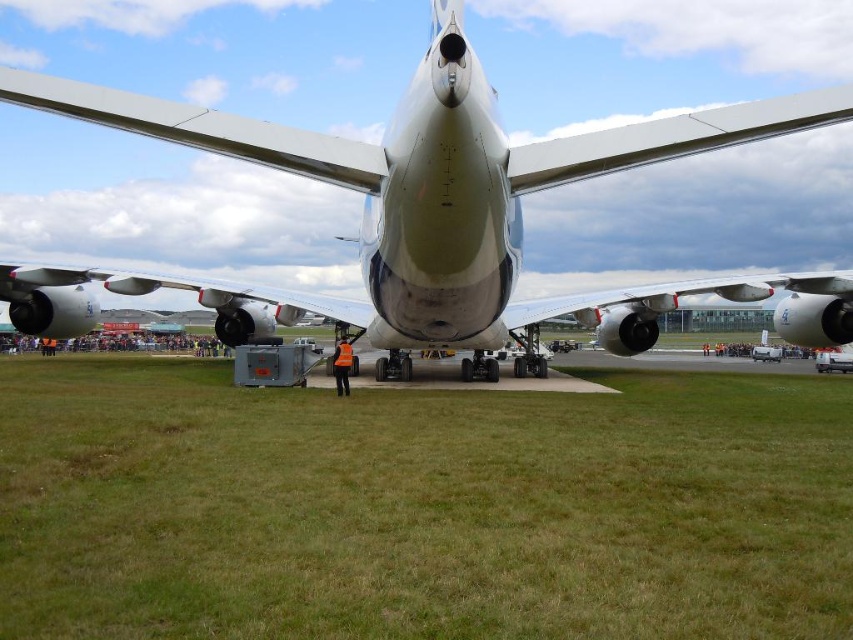
Question: Can you confirm if green grass at center is positioned above metallic silver airplane at center?

Choices:
 (A) yes
 (B) no

Answer: (B)

Question: Is the position of green grass at center more distant than that of metallic silver airplane at center?

Choices:
 (A) yes
 (B) no

Answer: (B)

Question: Among these points, which one is nearest to the camera?

Choices:
 (A) (379, 449)
 (B) (448, 346)

Answer: (A)

Question: Where is green grass at center located in relation to metallic silver airplane at center in the image?

Choices:
 (A) right
 (B) left

Answer: (B)

Question: Which object appears farthest from the camera in this image?

Choices:
 (A) green grass at center
 (B) metallic silver airplane at center

Answer: (B)

Question: Which object is closer to the camera taking this photo?

Choices:
 (A) metallic silver airplane at center
 (B) green grass at center

Answer: (B)